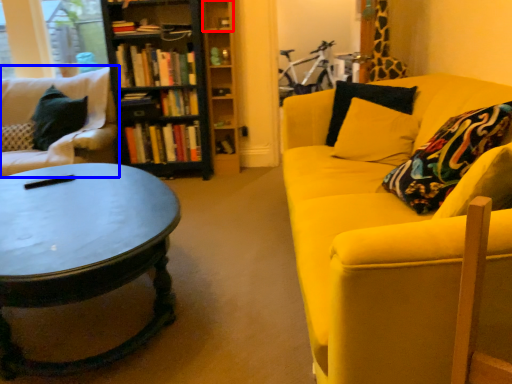
Question: Which object appears farthest to the camera in this image, shelf (highlighted by a red box) or studio couch (highlighted by a blue box)?

Choices:
 (A) shelf
 (B) studio couch

Answer: (A)